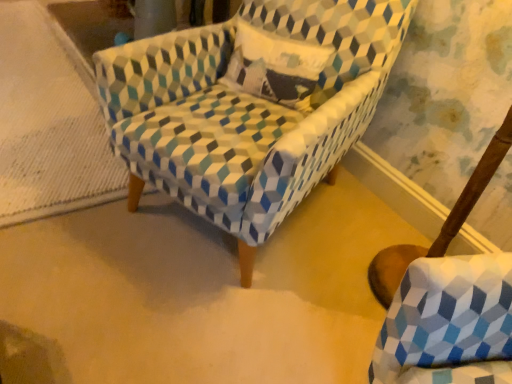
Identify the location of vacant space in front of textured fabric armchair at center. This screenshot has height=384, width=512. (188, 324).